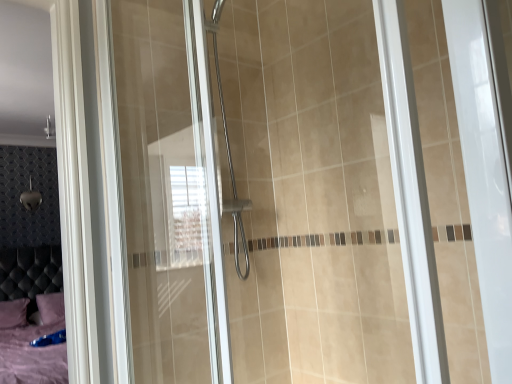
Question: In terms of width, does purple fabric pillow at lower left, acting as the 2th pillow starting from the right, look wider or thinner when compared to transparent glass shower door at center?

Choices:
 (A) thin
 (B) wide

Answer: (B)

Question: Is purple fabric pillow at lower left, acting as the 2th pillow starting from the right, taller or shorter than transparent glass shower door at center?

Choices:
 (A) short
 (B) tall

Answer: (A)

Question: Which object is the closest to the transparent glass shower door at center?

Choices:
 (A) purple fabric pillow at lower left, which appears as the 1th pillow when viewed from the left
 (B) purple fabric pillow at lower left, the first pillow viewed from the right

Answer: (B)

Question: Based on their relative distances, which object is nearer to the purple fabric pillow at lower left, the second pillow from the left?

Choices:
 (A) transparent glass shower door at center
 (B) purple fabric pillow at lower left, which appears as the 1th pillow when viewed from the left

Answer: (B)